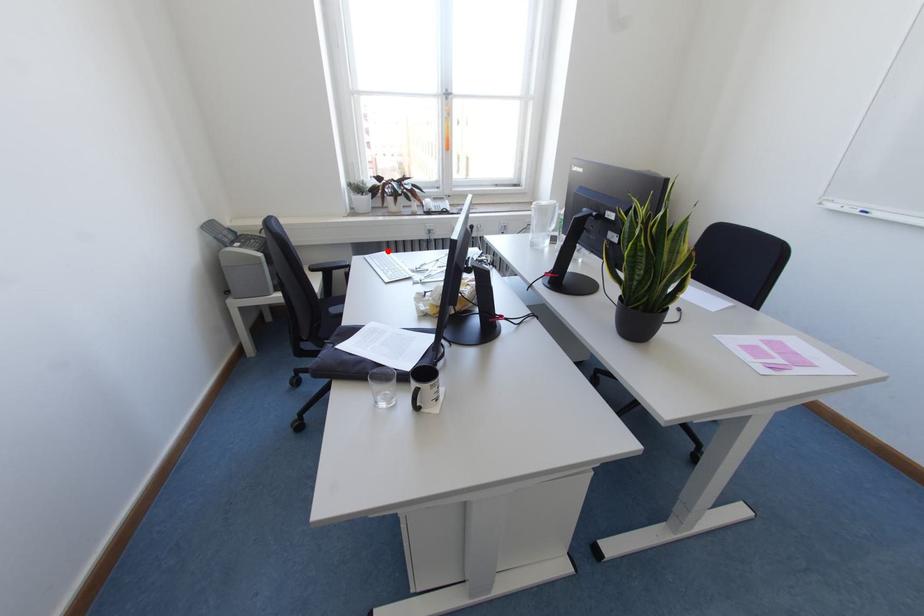
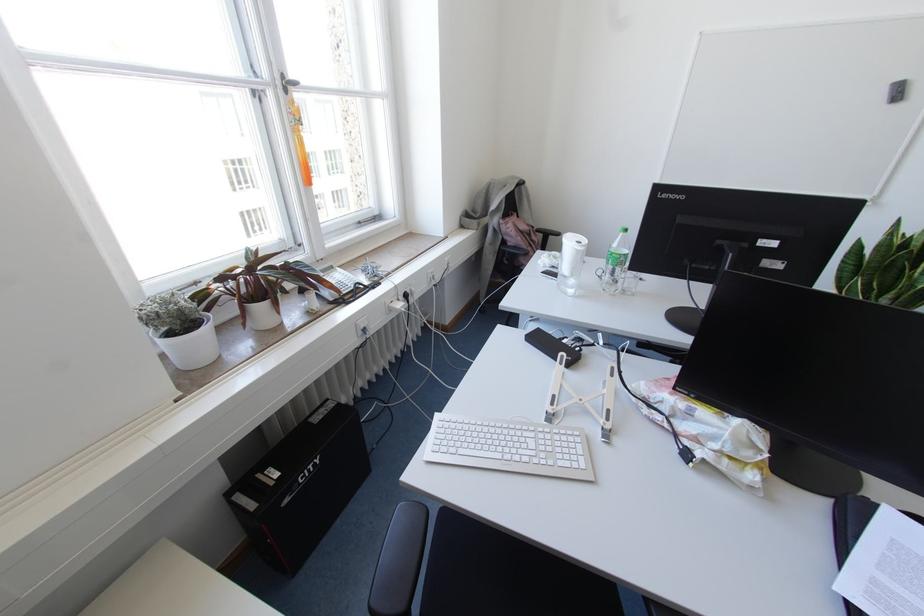
Question: I am providing you with two images of the same scene from different viewpoints. Image1 has a red point marked. In image2, the corresponding 3D location appears at what relative position? Reply with the corresponding letter.

Choices:
 (A) Closer
 (B) Farther

Answer: (A)